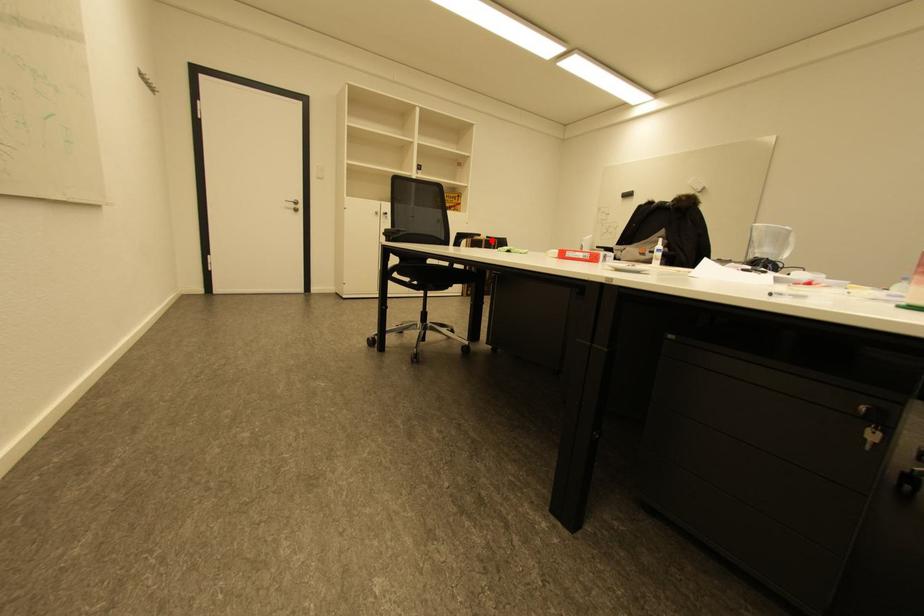
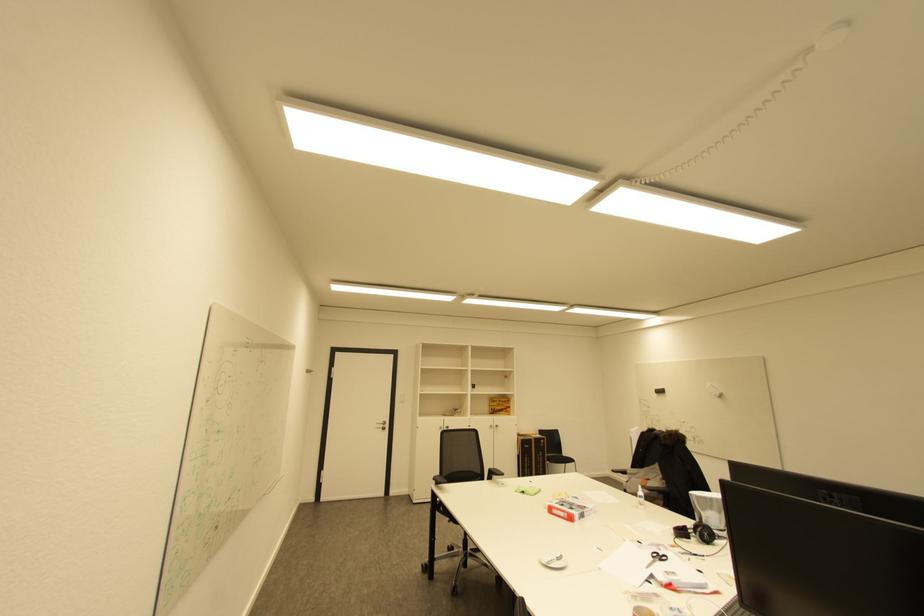
Find the pixel in the second image that matches the highlighted location in the first image.

(541, 439)